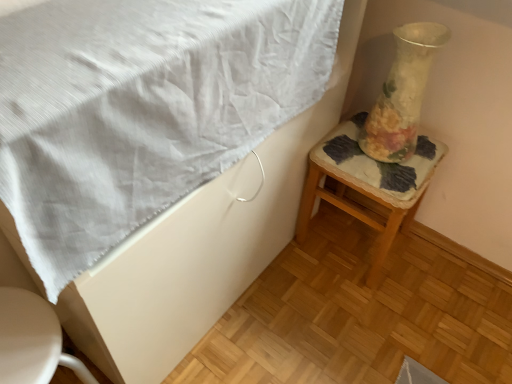
Question: Looking at their shapes, would you say translucent glass vase at right is wider or thinner than white glossy toilet at lower left?

Choices:
 (A) wide
 (B) thin

Answer: (B)

Question: Is translucent glass vase at right inside or outside of white glossy toilet at lower left?

Choices:
 (A) inside
 (B) outside

Answer: (B)

Question: Estimate the real-world distances between objects in this image. Which object is farther from the white textured blanket at upper left?

Choices:
 (A) translucent glass vase at right
 (B) wooden stool with floral cushion at right
 (C) white glossy toilet at lower left

Answer: (B)

Question: Which is farther from the white glossy toilet at lower left?

Choices:
 (A) wooden stool with floral cushion at right
 (B) white textured blanket at upper left
 (C) translucent glass vase at right

Answer: (C)